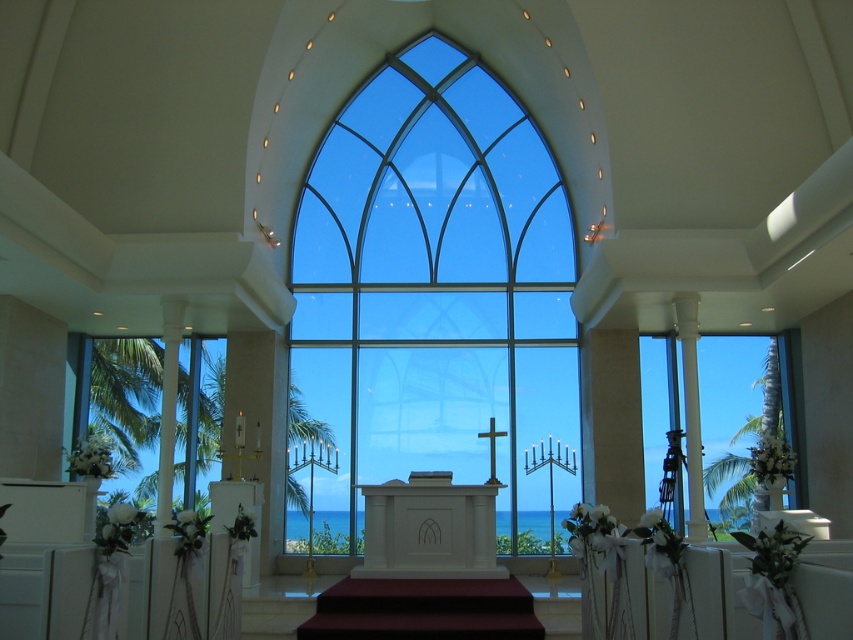
Question: Can you confirm if transparent glass window at center is positioned to the right of transparent glass window at right?

Choices:
 (A) yes
 (B) no

Answer: (B)

Question: Does transparent glass window at center appear on the left side of transparent glass window at right?

Choices:
 (A) yes
 (B) no

Answer: (A)

Question: Which of the following is the closest to the observer?

Choices:
 (A) (212, 451)
 (B) (505, 147)

Answer: (A)

Question: Can you confirm if transparent glass window at right is positioned to the left of clear glass window at left?

Choices:
 (A) yes
 (B) no

Answer: (B)

Question: Among these objects, which one is nearest to the camera?

Choices:
 (A) clear glass window at left
 (B) transparent glass window at right

Answer: (B)

Question: Among these points, which one is nearest to the camera?

Choices:
 (A) (722, 506)
 (B) (221, 371)

Answer: (A)